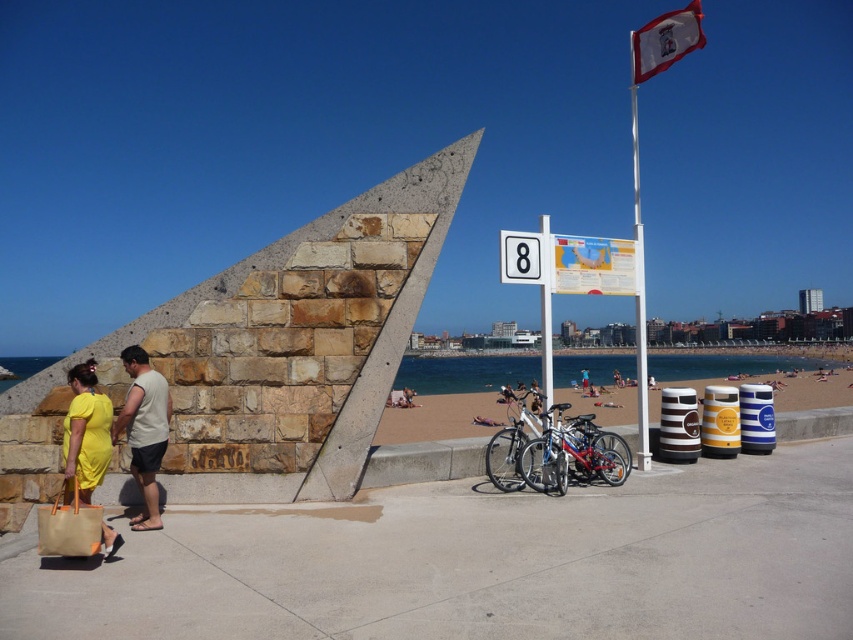
Question: Which object is closer to the camera taking this photo?

Choices:
 (A) yellow fabric couple at left
 (B) white paper map at center
 (C) silver metallic bicycle at center

Answer: (A)

Question: Which object appears closest to the camera in this image?

Choices:
 (A) white metallic pole at upper right
 (B) yellow fabric bag at lower left
 (C) white paper map at center
 (D) yellow fabric couple at left

Answer: (B)

Question: Does yellow fabric couple at left appear on the right side of metallic silver bicycle at center?

Choices:
 (A) no
 (B) yes

Answer: (A)

Question: Among these points, which one is nearest to the camera?

Choices:
 (A) (538, 248)
 (B) (490, 465)

Answer: (B)

Question: From the image, what is the correct spatial relationship of stone textured pyramid at center in relation to white metallic pole at upper right?

Choices:
 (A) below
 (B) above

Answer: (A)

Question: Is metallic silver bicycle at center in front of white plastic sign at center?

Choices:
 (A) no
 (B) yes

Answer: (B)